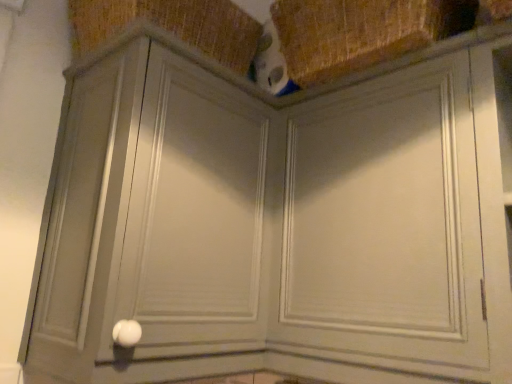
In order to face matte white cabinet at right, should I rotate leftwards or rightwards?

→ A 16.713 degree turn to the right will do.

Image resolution: width=512 pixels, height=384 pixels. Describe the element at coordinates (385, 222) in the screenshot. I see `matte white cabinet at right` at that location.

Locate an element on the screen. The image size is (512, 384). matte white cabinet at right is located at coordinates (385, 222).

Where is `matte white cabinet at right`? The image size is (512, 384). matte white cabinet at right is located at coordinates (385, 222).